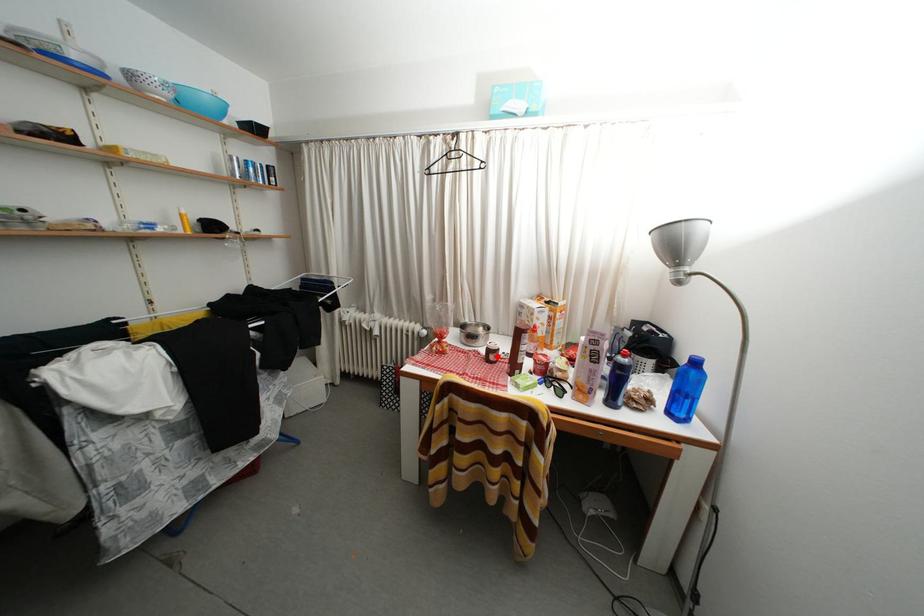
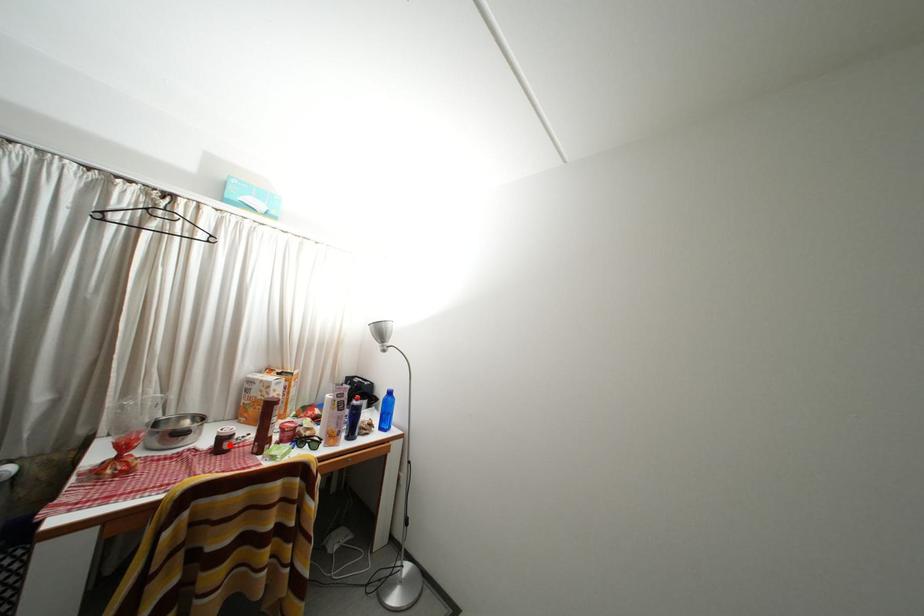
I am providing you with two images of the same scene from different viewpoints. A red point is marked on the first image and another point is marked on the second image. Is the marked point in image1 the same physical position as the marked point in image2?

Yes